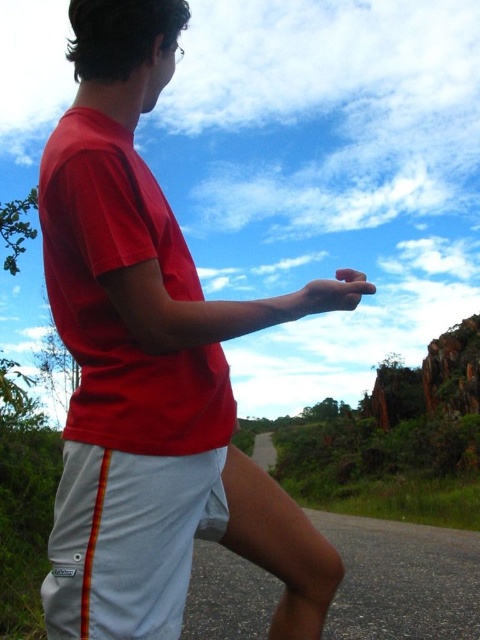
Looking at this image, you are a fashion designer analyzing the outfit of a person in an outdoor setting. The person is wearing a red matte shirt at center and white cotton shorts at lower center. Which piece of clothing is positioned higher on the body?

The red matte shirt at center is positioned higher on the body than the white cotton shorts at lower center.